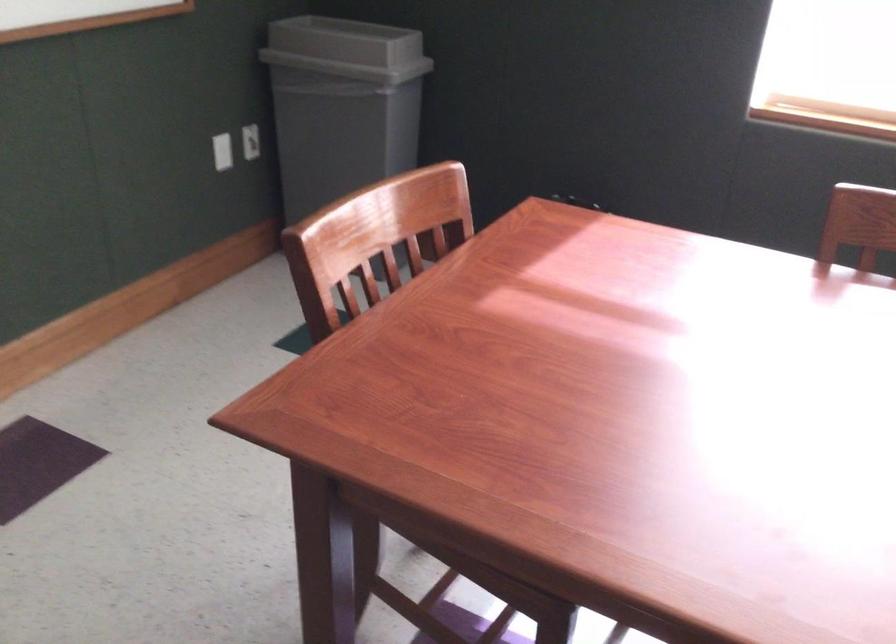
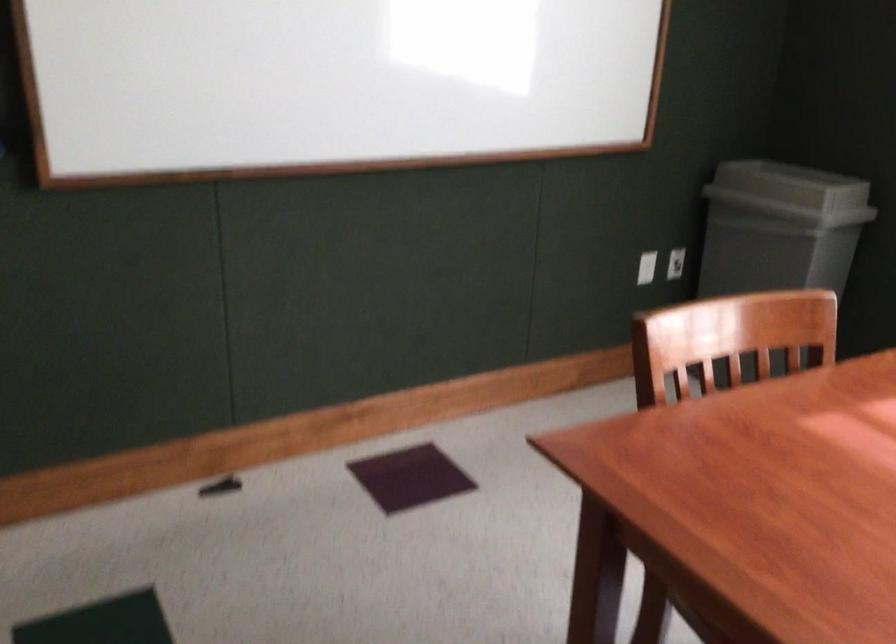
Locate, in the second image, the point that corresponds to (x=252, y=147) in the first image.

(675, 263)